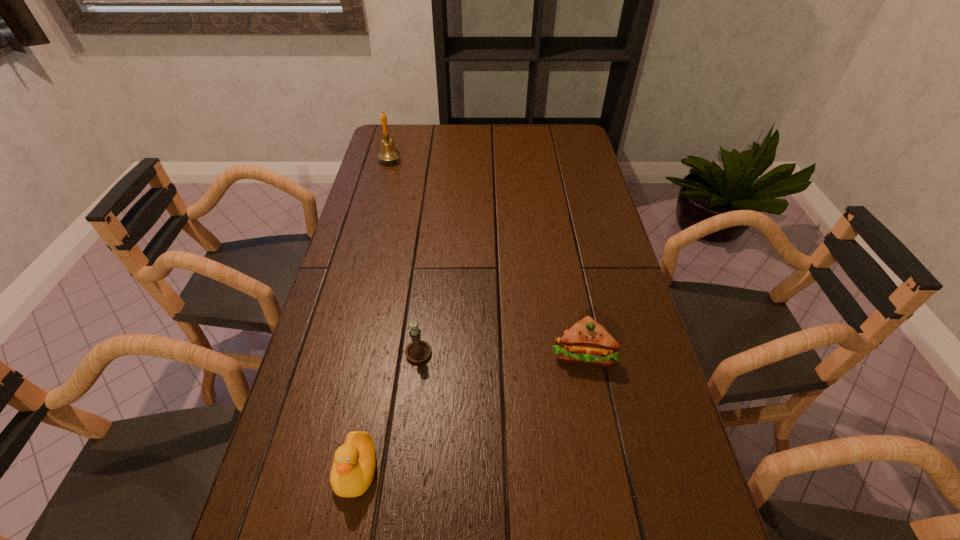
Where is `object that stands as the closest to the rightmost object`? object that stands as the closest to the rightmost object is located at coordinates (418, 350).

Where is `the second closest object relative to the rightmost object`? the second closest object relative to the rightmost object is located at coordinates (353, 469).

The width and height of the screenshot is (960, 540). I want to click on blank area in the image that satisfies the following two spatial constraints: 1. on the front side of the bell; 2. on the left side of the rightmost object, so [339, 353].